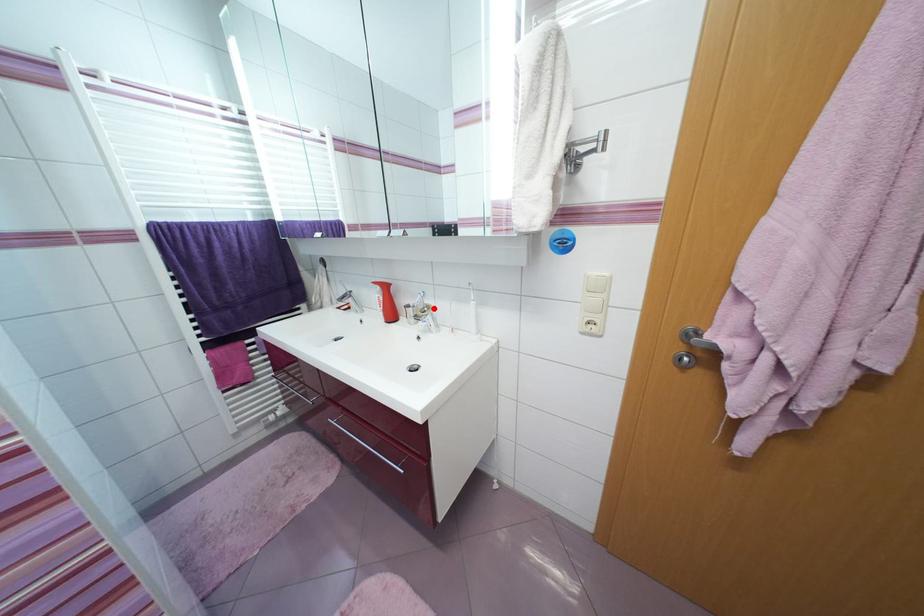
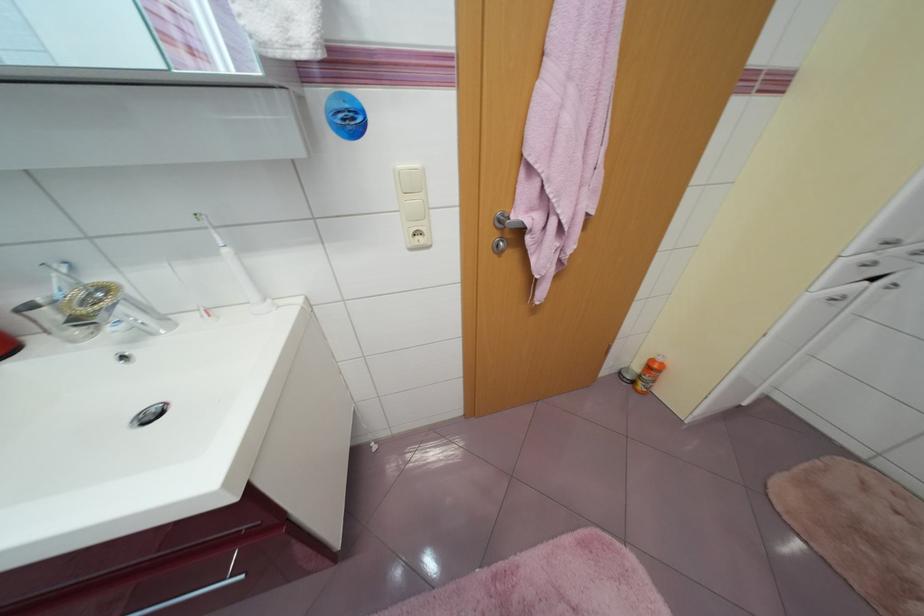
The point at the highlighted location is marked in the first image. Where is the corresponding point in the second image?

(112, 291)